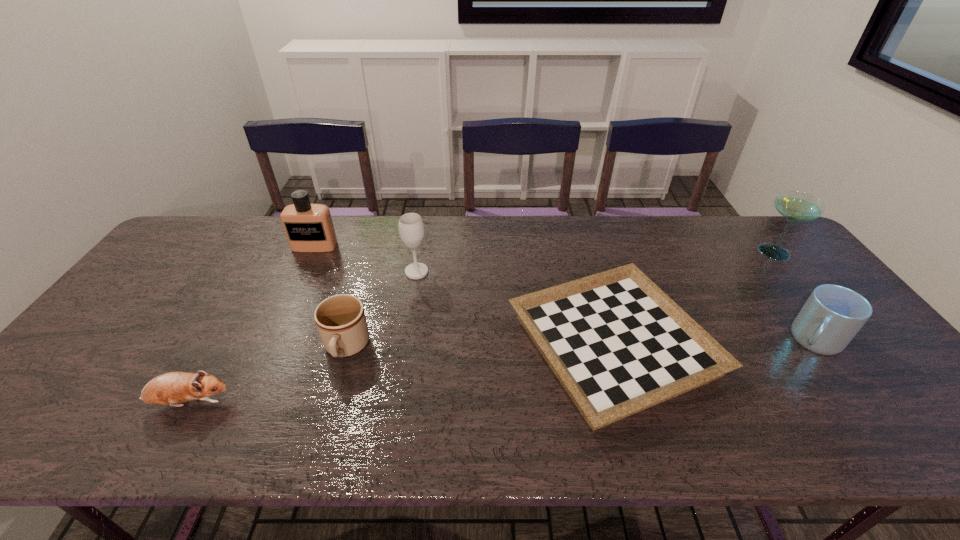
You are a GUI agent. You are given a task and a screenshot of the screen. Output one action in this format:
    pyautogui.click(x=<x>, y=<y>)
    Task: Click on the free region located on the front label of the perfume
    
    Given the screenshot: What is the action you would take?
    pyautogui.click(x=279, y=321)

You are a GUI agent. You are given a task and a screenshot of the screen. Output one action in this format:
    pyautogui.click(x=<x>, y=<y>)
    Task: Click on the free space located 0.210m on the front of the wineglass
    Image resolution: width=960 pixels, height=540 pixels.
    Given the screenshot: What is the action you would take?
    pyautogui.click(x=406, y=333)

Find the location of `free space located 0.080m on the left of the right mug`. free space located 0.080m on the left of the right mug is located at coordinates (755, 340).

The image size is (960, 540). What are the coordinates of `free space located on the side of the left mug with the handle` in the screenshot? It's located at pos(326,414).

Find the location of a particular element. The width and height of the screenshot is (960, 540). vacant position located 0.140m at the face of the sixth tallest object is located at coordinates (293, 403).

What are the coordinates of `free space located on the left of the checkerboard` in the screenshot? It's located at (486, 345).

Find the location of a particular element. The height and width of the screenshot is (540, 960). martini that is at the far edge is located at coordinates (795, 206).

What are the coordinates of `perfume situated at the far edge` in the screenshot? It's located at click(x=309, y=228).

Where is `hamster located at the near edge`? This screenshot has height=540, width=960. hamster located at the near edge is located at coordinates (171, 388).

Locate an element on the screen. This screenshot has height=540, width=960. checkerboard at the near edge is located at coordinates (618, 344).